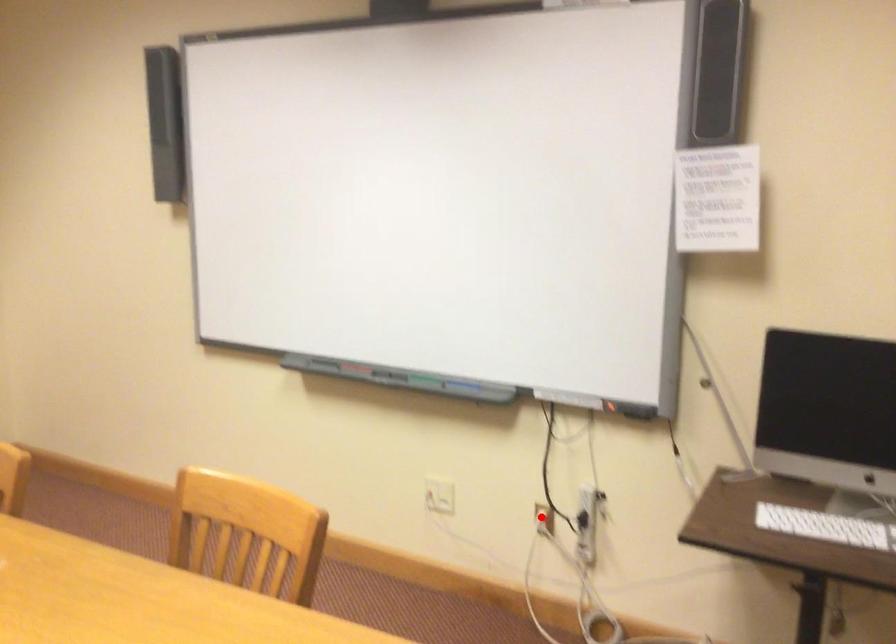
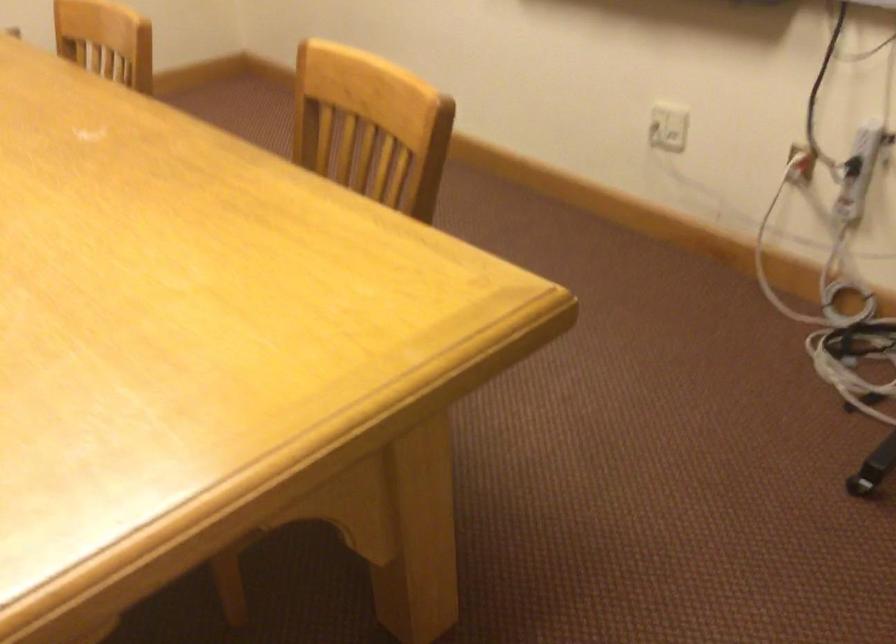
Question: I am providing you with two images of the same scene from different viewpoints. A red point is shown in image1. For the corresponding object point in image2, is it positioned nearer or farther from the camera?

Choices:
 (A) Nearer
 (B) Farther

Answer: (A)